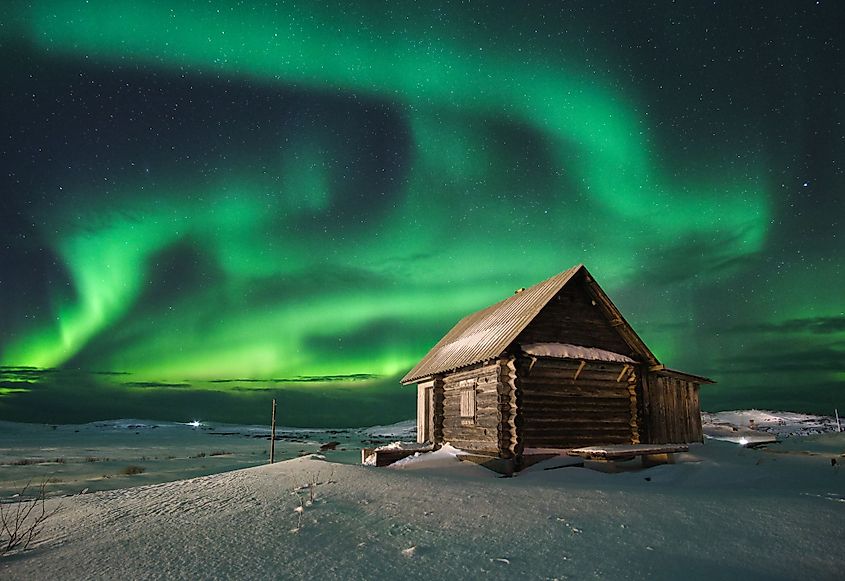
The width and height of the screenshot is (845, 581). I want to click on wooden door, so click(x=428, y=401).